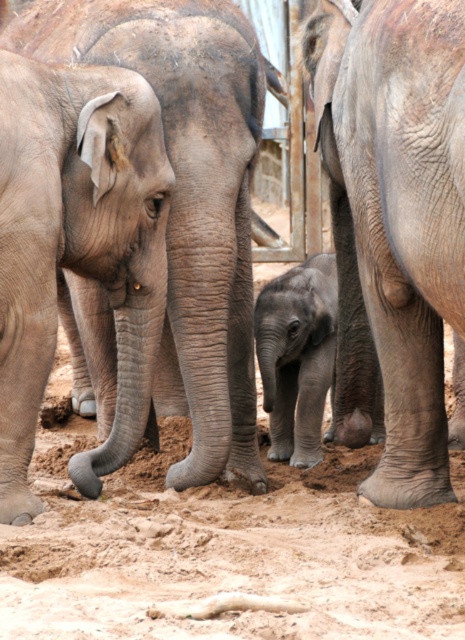
You are a zookeeper planning to place a new water trough in the enclosure. You want to ensure it is accessible to both the calf and the adult elephants. Based on the image, which point should you choose to place the trough so that it is closer to the calf than to the adult? Please choose between point A at point (12,74) and point B at point (296,316).

Point A at point (12,74) is closer to the calf than to the adult elephant, so you should place the trough there.

You are a zookeeper observing the elephants in their enclosure. You need to determine the spatial relationship between the gray wrinkled elephant at center and the gray matte elephant at left. Which elephant is closer to the front of the enclosure?

The gray wrinkled elephant at center is positioned over the gray matte elephant at left, meaning it is closer to the front of the enclosure.

You are a zookeeper observing the elephants in their enclosure. You need to identify which elephant is bigger between the gray wrinkled elephant at center and the gray matte elephant at left. Which one is larger?

The gray wrinkled elephant at center is larger in size than the gray matte elephant at left.